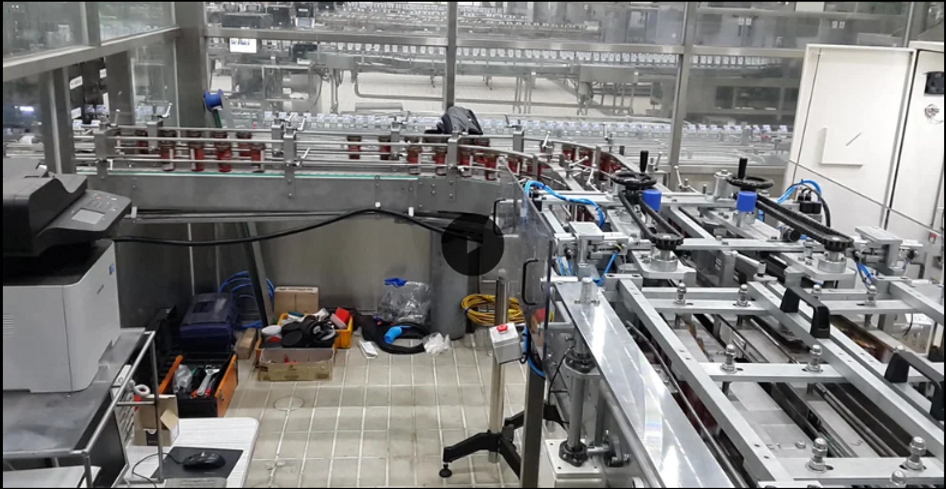
At what (x,y) coordinates should I click in order to perform the action: click on printer. Please return your answer as a coordinate pair (x, y). The height and width of the screenshot is (489, 946). Looking at the image, I should click on (45, 229).